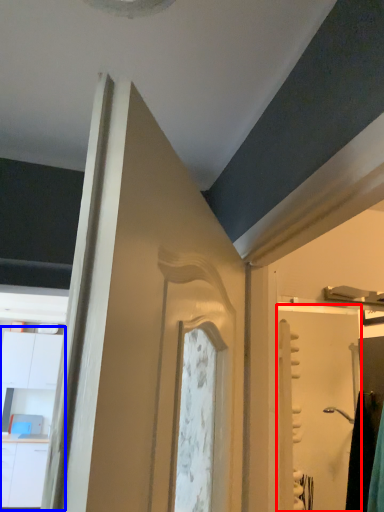
Question: Among these objects, which one is nearest to the camera, screen door (highlighted by a red box) or dresser (highlighted by a blue box)?

Choices:
 (A) screen door
 (B) dresser

Answer: (A)